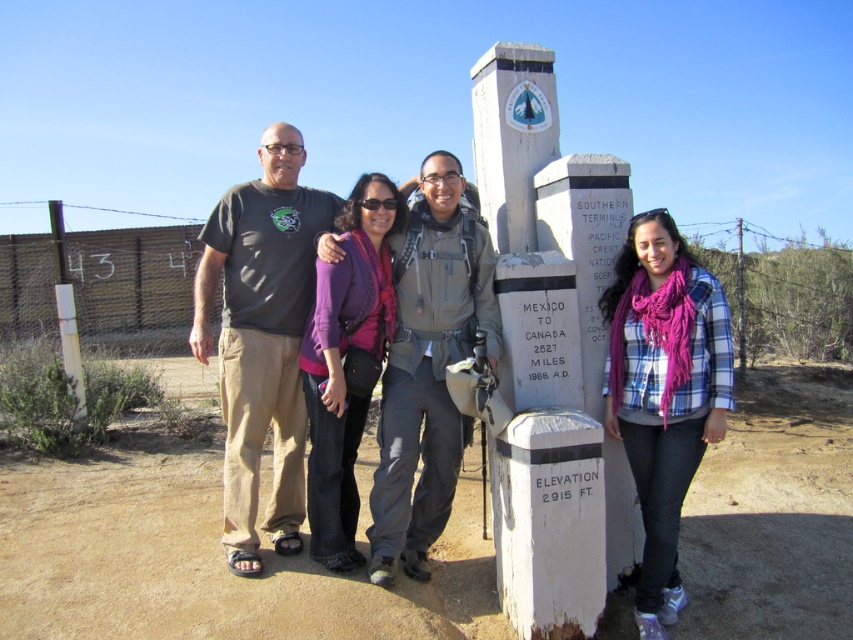
You are standing at the monument and see a point marked at coordinates (204, 557). What is the surface material at that point?

The point at (204, 557) is on brown sandy dirt at lower center.